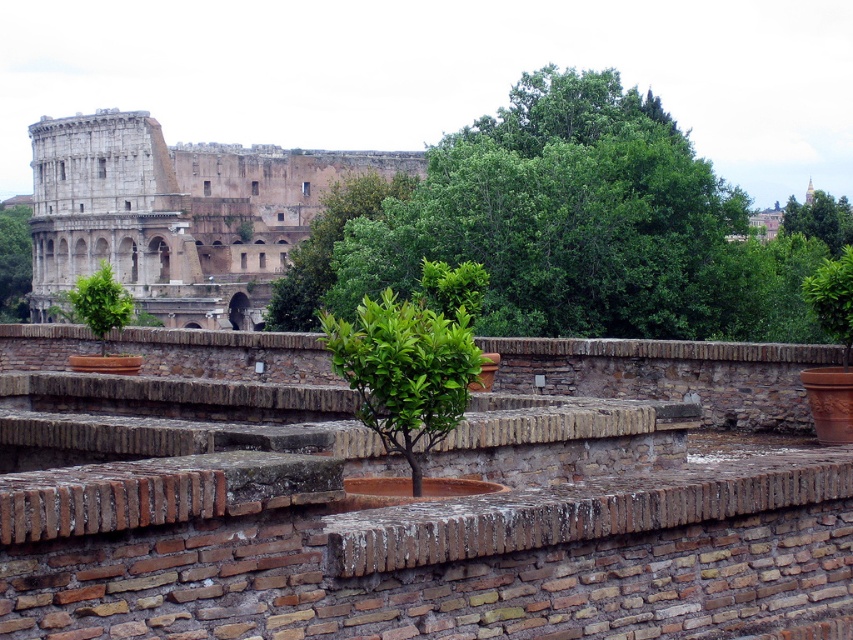
You are standing on the rooftop garden and want to take a photo of the green leafy tree at center. If your camera can focus on objects up to 60 meters away, will it be able to capture the tree clearly?

The green leafy tree at center is 64.02 meters away from the camera, which is beyond the camera focus range of 60 meters. Therefore, the camera will not be able to capture the tree clearly.

You are standing on the rooftop garden and want to place a new potted plant between the green leafy tree at center and the green leafy tree at left. Based on their positions, which tree should the new plant be closer to?

The green leafy tree at center is below the green leafy tree at left. Therefore, the new plant should be placed closer to the green leafy tree at center since it is lower in position.

You are standing at the center of the rooftop garden. There is a green leafy tree at left represented by point (x=15, y=262). Which direction should you walk to reach the green leafy tree at left?

The green leafy tree at left is located at point (x=15, y=262), so you should walk towards the left direction to reach it.